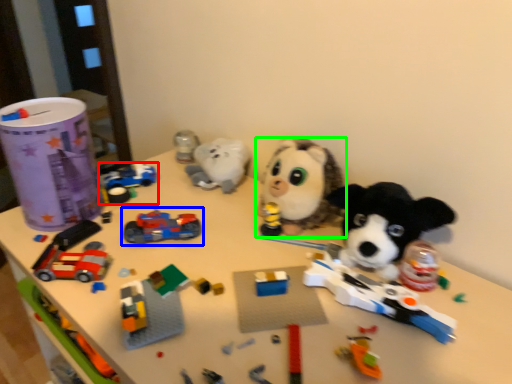
Question: Considering the real-world distances, which object is closest to toy (highlighted by a red box)? toy (highlighted by a blue box) or toy (highlighted by a green box).

Choices:
 (A) toy
 (B) toy

Answer: (A)